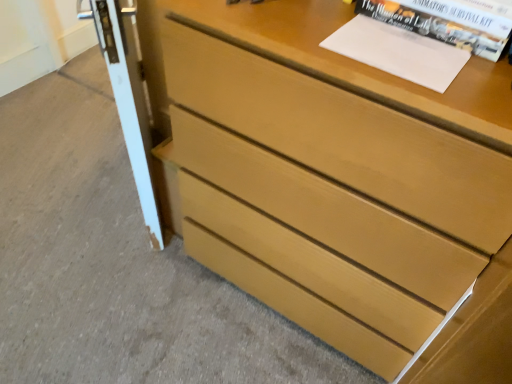
Identify the location of vacant space in front of white glossy screen door at left. (111, 273).